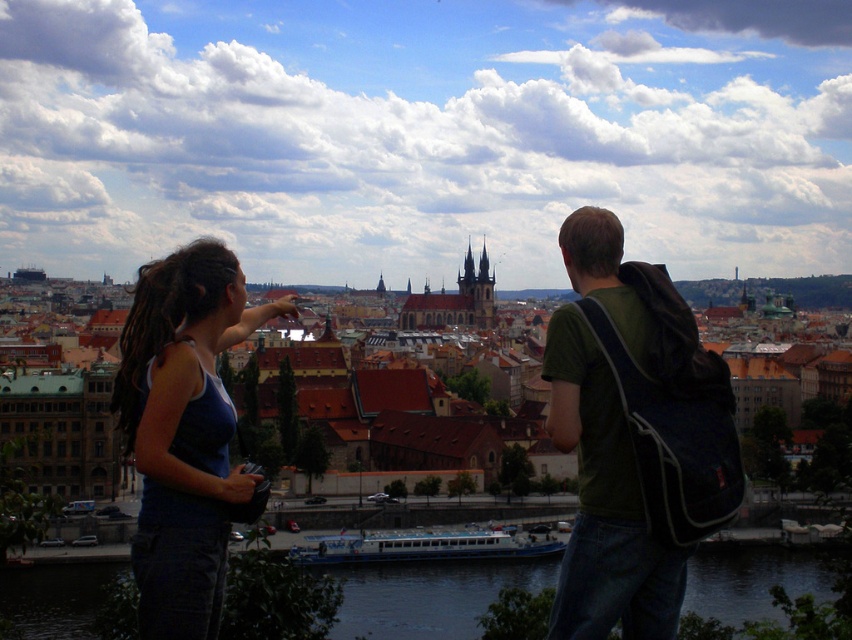
Is green fabric backpack at center in front of matte blue tank top at center-left?

No, it is behind matte blue tank top at center-left.

Who is lower down, green fabric backpack at center or matte blue tank top at center-left?

matte blue tank top at center-left is below.

Describe the element at coordinates (632, 436) in the screenshot. This screenshot has width=852, height=640. I see `green fabric backpack at center` at that location.

The width and height of the screenshot is (852, 640). What are the coordinates of `green fabric backpack at center` in the screenshot? It's located at point(632,436).

Based on the photo, between matte black backpack at center and green fabric backpack at center, which one is positioned lower?

matte black backpack at center

Does matte black backpack at center have a larger size compared to green fabric backpack at center?

Yes, matte black backpack at center is bigger than green fabric backpack at center.

I want to click on matte black backpack at center, so click(x=632, y=436).

Which is above, matte black backpack at center or dark blue water at lower center?

matte black backpack at center is higher up.

Which is in front, point (547, 378) or point (764, 580)?

Positioned in front is point (547, 378).

Locate an element on the screen. Image resolution: width=852 pixels, height=640 pixels. matte black backpack at center is located at coordinates (632, 436).